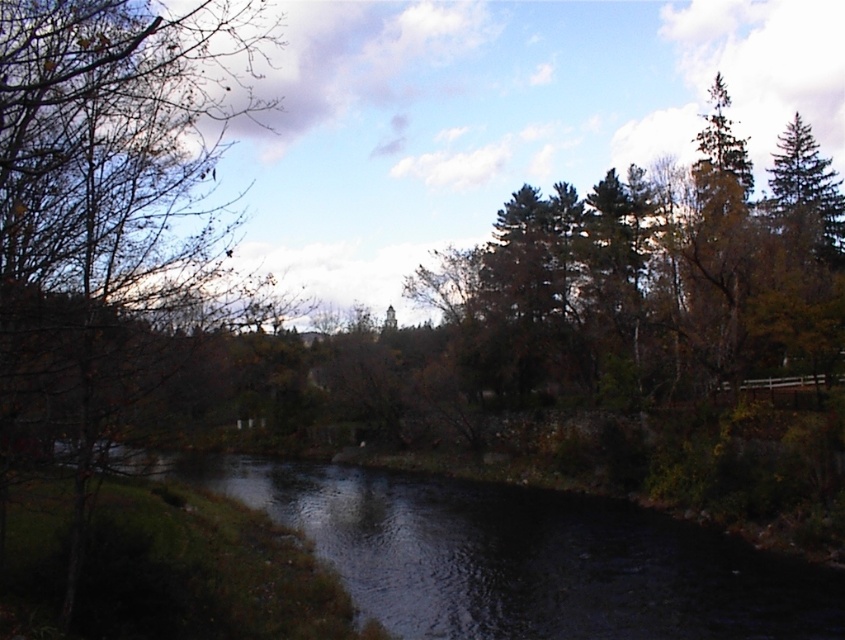
You are standing at the point marked by the coordinates point (112,212) in the scene. Looking around, you see the brown leafy tree at left. Which direction should you face to look towards the brown leafy tree at left?

The point (112,212) represents the brown leafy tree at left, so you are already at the location of the brown leafy tree at left. Therefore, you don t need to face any direction to look towards it.

You are standing at the point with coordinates point (472,636) and want to move towards the point (69,419). Based on the scene description, will you be moving towards or away from the leafless branches on the left side of the image?

Since point (69,419) is closer to the viewer than point (472,636), moving from point (472,636) towards point (69,419) would mean moving towards the leafless branches on the left side of the image.

You are standing at the center of the image and want to walk towards the brown leafy tree at left. Which direction should you face?

You should face the left direction to walk towards the brown leafy tree at left since it is located at the left side of the image.